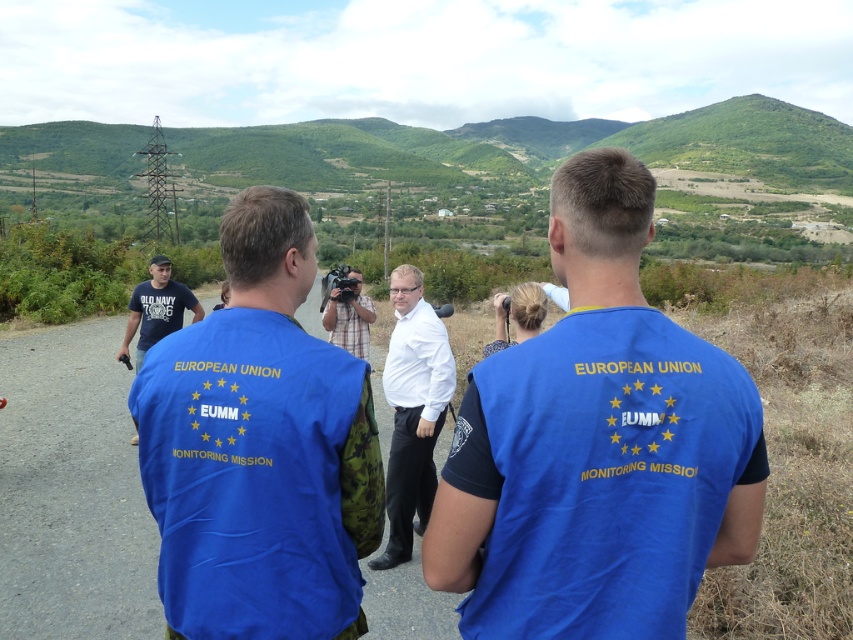
You are part of the EUMM team and need to determine the visibility of two points marked in the image. Which point, point (177,358) or point (323,310), is closer to your current position?

Point (177,358) is closer to the viewer than point (323,310), so it is closer to your current position.

You are part of the EUMM team and need to identify clothing items for a report. Which clothing item is positioned to the right when looking at the blue fabric vest at center and the plaid shirt at center?

The blue fabric vest at center is positioned to the right of the plaid shirt at center.